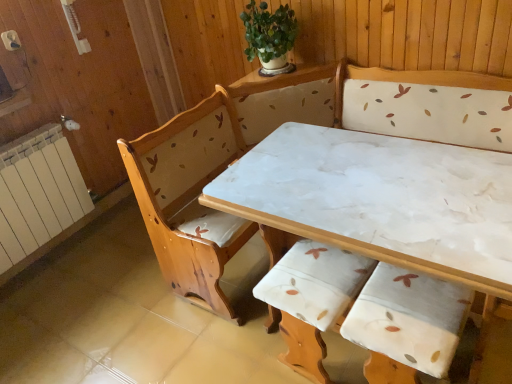
Where is `vacant area situated to the left side of wooden armchair with floral upholstery at center`? vacant area situated to the left side of wooden armchair with floral upholstery at center is located at coordinates (247, 349).